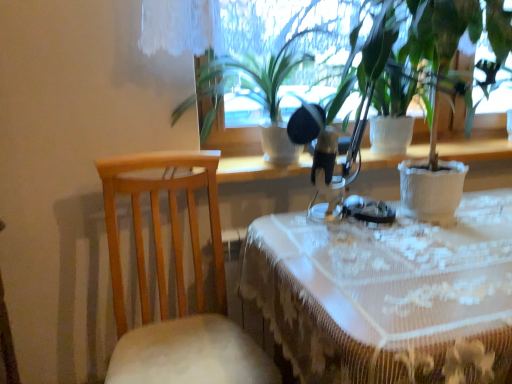
Question: Is white lace tablecloth at center to the left of light wood chair at left from the viewer's perspective?

Choices:
 (A) no
 (B) yes

Answer: (A)

Question: Is white lace tablecloth at center beside light wood chair at left?

Choices:
 (A) no
 (B) yes

Answer: (A)

Question: From the image's perspective, would you say white lace tablecloth at center is shown under light wood chair at left?

Choices:
 (A) no
 (B) yes

Answer: (B)

Question: Would you consider white lace tablecloth at center to be distant from light wood chair at left?

Choices:
 (A) yes
 (B) no

Answer: (B)

Question: Does white lace tablecloth at center contain light wood chair at left?

Choices:
 (A) yes
 (B) no

Answer: (B)

Question: Considering the positions of green matte plant at center, which appears as the 2th houseplant when viewed from the right, and white textured pot at center, placed as the first houseplant when sorted from right to left, in the image, is green matte plant at center, which appears as the 2th houseplant when viewed from the right, bigger or smaller than white textured pot at center, placed as the first houseplant when sorted from right to left,?

Choices:
 (A) big
 (B) small

Answer: (B)

Question: Is green matte plant at center, which appears as the 2th houseplant when viewed from the right, wider or thinner than white textured pot at center, placed as the first houseplant when sorted from right to left?

Choices:
 (A) wide
 (B) thin

Answer: (A)

Question: Is green matte plant at center, the 1th houseplant when ordered from left to right, inside the boundaries of white textured pot at center, marked as the second houseplant in a left-to-right arrangement, or outside?

Choices:
 (A) inside
 (B) outside

Answer: (B)

Question: From a real-world perspective, relative to white textured pot at center, marked as the second houseplant in a left-to-right arrangement, is green matte plant at center, the 1th houseplant when ordered from left to right, vertically above or below?

Choices:
 (A) below
 (B) above

Answer: (A)

Question: Based on their sizes in the image, would you say white textured pot at center, marked as the second houseplant in a left-to-right arrangement, is bigger or smaller than light wood chair at left?

Choices:
 (A) small
 (B) big

Answer: (A)

Question: From the image's perspective, is white textured pot at center, marked as the second houseplant in a left-to-right arrangement, located above or below light wood chair at left?

Choices:
 (A) below
 (B) above

Answer: (B)

Question: In terms of height, does white textured pot at center, marked as the second houseplant in a left-to-right arrangement, look taller or shorter compared to light wood chair at left?

Choices:
 (A) short
 (B) tall

Answer: (A)

Question: Is white textured pot at center, placed as the first houseplant when sorted from right to left, inside or outside of light wood chair at left?

Choices:
 (A) inside
 (B) outside

Answer: (B)

Question: In the image, is white textured pot at center, placed as the first houseplant when sorted from right to left, on the left side or the right side of green matte plant at center, which appears as the 2th houseplant when viewed from the right?

Choices:
 (A) left
 (B) right

Answer: (B)

Question: Considering the positions of white textured pot at center, placed as the first houseplant when sorted from right to left, and green matte plant at center, which appears as the 2th houseplant when viewed from the right, in the image, is white textured pot at center, placed as the first houseplant when sorted from right to left, bigger or smaller than green matte plant at center, which appears as the 2th houseplant when viewed from the right,?

Choices:
 (A) small
 (B) big

Answer: (B)